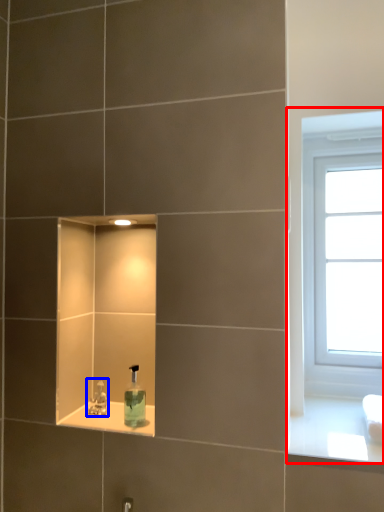
Question: Which point is further to the camera, window (highlighted by a red box) or tap (highlighted by a blue box)?

Choices:
 (A) window
 (B) tap

Answer: (A)